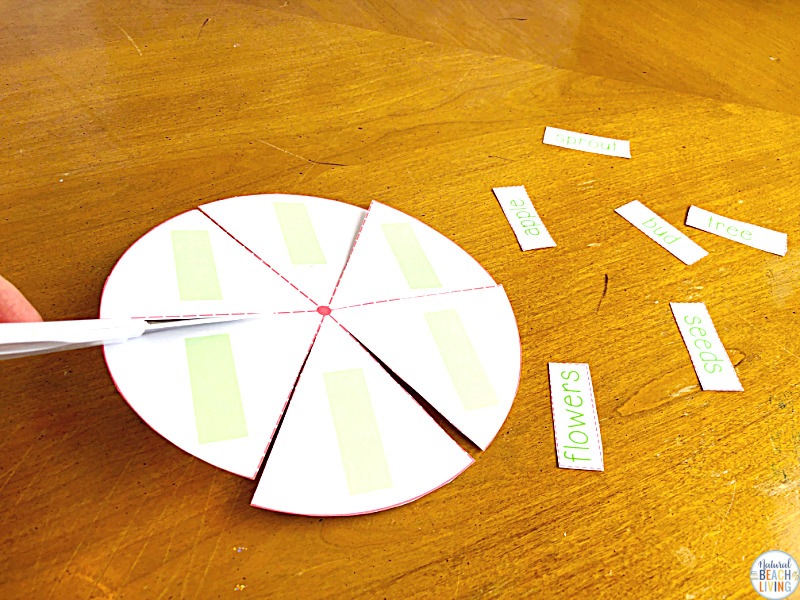
Locate an element on the screen. table is located at coordinates (512, 550).